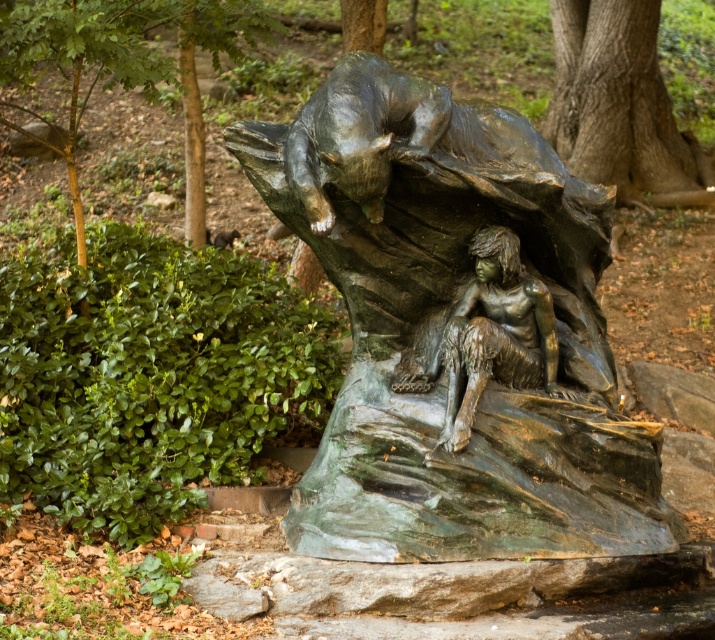
You are an artist planning to sketch the sculpture from the front. You need to know the exact position of the smooth brown bark at upper center in the image. What are its coordinates?

The smooth brown bark at upper center is located at coordinates point (618,104).

You are standing in front of the bronze sculpture in the park. There is a smooth brown bark at upper center marked by point [618,104]. Can you tell me what object is located at that coordinate?

The smooth brown bark at upper center is located at point [618,104].

You are a park visitor standing in front of the bronze sculpture. You notice the smooth brown bark at upper center and the bronze figure at center. Which object is positioned higher relative to the other?

The smooth brown bark at upper center is positioned above the bronze figure at center.